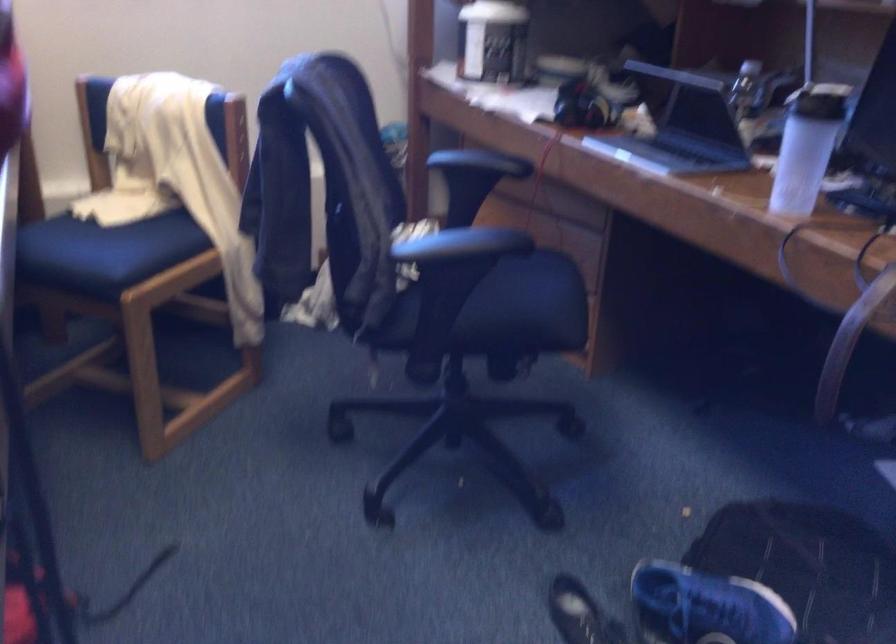
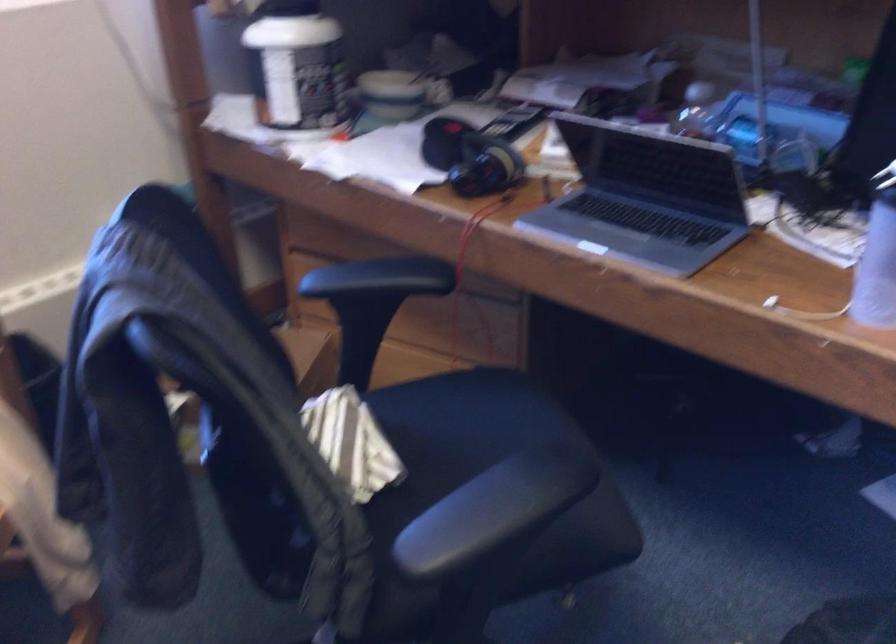
Where in the second image is the point corresponding to point 784,167 from the first image?

(876, 268)